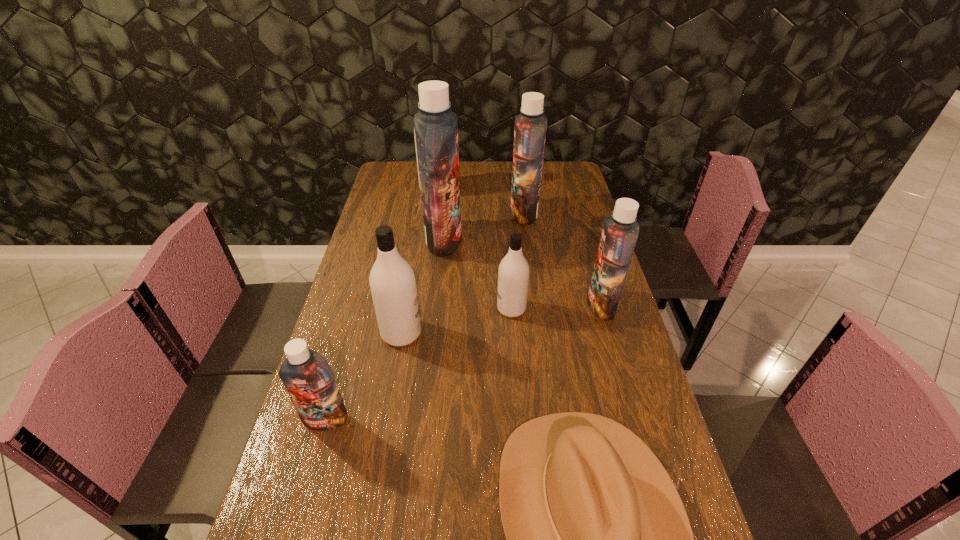
This screenshot has height=540, width=960. Identify the location of the tallest object. (436, 127).

Find the location of a particular element. the tallest shampoo is located at coordinates (436, 127).

You are a GUI agent. You are given a task and a screenshot of the screen. Output one action in this format:
    pyautogui.click(x=<x>, y=<y>)
    Task: Click on the third blue shampoo from left to right
    The height and width of the screenshot is (540, 960).
    Given the screenshot: What is the action you would take?
    pyautogui.click(x=530, y=125)

Where is `the farthest object`? the farthest object is located at coordinates (428, 77).

The image size is (960, 540). I want to click on the farthest shampoo, so click(428, 77).

Image resolution: width=960 pixels, height=540 pixels. What are the coordinates of `the rightmost blue shampoo` in the screenshot? It's located at (620, 232).

This screenshot has width=960, height=540. In order to click on the rightmost shampoo in this screenshot , I will do `click(620, 232)`.

Where is `the second smallest white shampoo`? This screenshot has width=960, height=540. the second smallest white shampoo is located at coordinates (392, 281).

Find the location of a particular element. Image resolution: width=960 pixels, height=540 pixels. the rightmost white shampoo is located at coordinates (513, 274).

You are a GUI agent. You are given a task and a screenshot of the screen. Output one action in this format:
    pyautogui.click(x=<x>, y=<y>)
    Task: Click on the smallest blue shampoo
    
    Given the screenshot: What is the action you would take?
    pyautogui.click(x=309, y=380)